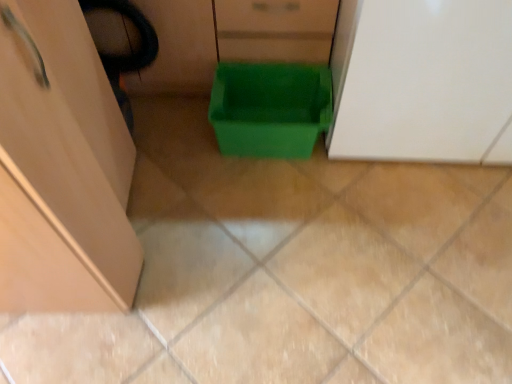
What do you see at coordinates (420, 79) in the screenshot? I see `white glossy cabinet at upper right` at bounding box center [420, 79].

At what (x,y) coordinates should I click in order to perform the action: click on white glossy cabinet at upper right. Please return your answer as a coordinate pair (x, y). This screenshot has width=512, height=384. Looking at the image, I should click on (420, 79).

Measure the distance between point [428,4] and camera.

The distance of point [428,4] from camera is 37.28 inches.

Locate an element on the screen. The width and height of the screenshot is (512, 384). green plastic bin at center is located at coordinates (270, 108).

What do you see at coordinates (270, 108) in the screenshot?
I see `green plastic bin at center` at bounding box center [270, 108].

Find the location of `white glossy cabinet at upper right`. white glossy cabinet at upper right is located at coordinates (420, 79).

Which object is positioned more to the left, green plastic bin at center or white glossy cabinet at upper right?

green plastic bin at center.

Which object is further away from the camera, green plastic bin at center or white glossy cabinet at upper right?

green plastic bin at center is further from the camera.

Which point is more forward, [252,148] or [354,89]?

Point [354,89]

From the image's perspective, is green plastic bin at center on top of white glossy cabinet at upper right?

No, from the image's perspective, green plastic bin at center is not on top of white glossy cabinet at upper right.

From a real-world perspective, is green plastic bin at center physically located above or below white glossy cabinet at upper right?

green plastic bin at center is situated lower than white glossy cabinet at upper right in the real world.

Looking at their sizes, would you say green plastic bin at center is wider or thinner than white glossy cabinet at upper right?

In the image, green plastic bin at center appears to be more narrow than white glossy cabinet at upper right.

Which of these two, green plastic bin at center or white glossy cabinet at upper right, stands taller?

With more height is white glossy cabinet at upper right.

Who is bigger, green plastic bin at center or white glossy cabinet at upper right?

white glossy cabinet at upper right is bigger.

In the scene shown: Is white glossy cabinet at upper right surrounded by green plastic bin at center?

No, white glossy cabinet at upper right is located outside of green plastic bin at center.

Is green plastic bin at center far from white glossy cabinet at upper right?

No, there isn't a large distance between green plastic bin at center and white glossy cabinet at upper right.

Is green plastic bin at center positioned with its back to white glossy cabinet at upper right?

No, green plastic bin at center is not facing away from white glossy cabinet at upper right.

What's the angular difference between green plastic bin at center and white glossy cabinet at upper right's facing directions?

A: They differ by 0.919 degrees in their facing directions.

Where is `storage box behind the white glossy cabinet at upper right`? The image size is (512, 384). storage box behind the white glossy cabinet at upper right is located at coordinates (270, 108).

Which is more to the left, white glossy cabinet at upper right or green plastic bin at center?

From the viewer's perspective, green plastic bin at center appears more on the left side.

Is the position of white glossy cabinet at upper right more distant than that of green plastic bin at center?

No, white glossy cabinet at upper right is in front of green plastic bin at center.

Considering the positions of points (470, 120) and (273, 93), is point (470, 120) closer to camera compared to point (273, 93)?

Yes, point (470, 120) is in front of point (273, 93).

From the image's perspective, is white glossy cabinet at upper right located above or below green plastic bin at center?

Based on their image positions, white glossy cabinet at upper right is located above green plastic bin at center.

From a real-world perspective, is white glossy cabinet at upper right physically located above or below green plastic bin at center?

white glossy cabinet at upper right is above green plastic bin at center.

In terms of width, does white glossy cabinet at upper right look wider or thinner when compared to green plastic bin at center?

In the image, white glossy cabinet at upper right appears to be wider than green plastic bin at center.

Considering the sizes of objects white glossy cabinet at upper right and green plastic bin at center in the image provided, who is shorter, white glossy cabinet at upper right or green plastic bin at center?

With less height is green plastic bin at center.

Between white glossy cabinet at upper right and green plastic bin at center, which one has larger size?

Bigger between the two is white glossy cabinet at upper right.

Is white glossy cabinet at upper right not within green plastic bin at center?

Yes, white glossy cabinet at upper right is outside of green plastic bin at center.

Is white glossy cabinet at upper right in contact with green plastic bin at center?

No, white glossy cabinet at upper right is not making contact with green plastic bin at center.

Is white glossy cabinet at upper right positioned with its back to green plastic bin at center?

No.

The image size is (512, 384). In order to click on cabinetry that appears above the green plastic bin at center (from the image's perspective) in this screenshot , I will do `click(420, 79)`.

Locate an element on the screen. cabinetry above the green plastic bin at center (from a real-world perspective) is located at coordinates (420, 79).

The image size is (512, 384). I want to click on storage box on the left of the white glossy cabinet at upper right, so point(270,108).